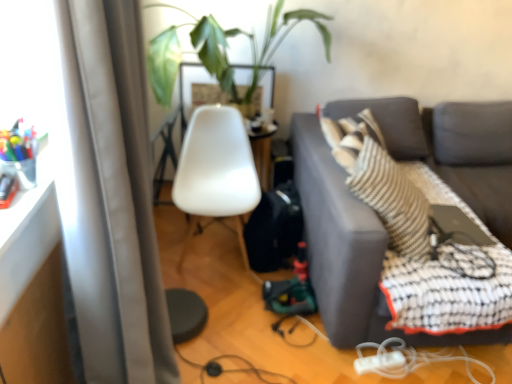
Locate an element on the screen. This screenshot has width=512, height=384. satin gray curtain at left is located at coordinates (110, 195).

Where is `black rubber cable at lower center, arranged as the 2th cable when viewed from the right`? The width and height of the screenshot is (512, 384). black rubber cable at lower center, arranged as the 2th cable when viewed from the right is located at coordinates (231, 369).

Measure the distance between green leafy plant at upper center and camera.

7.15 feet.

Find the location of a particular element. The width and height of the screenshot is (512, 384). green leafy plant at upper center is located at coordinates (222, 49).

Image resolution: width=512 pixels, height=384 pixels. Identify the location of dark gray fabric couch at right. (x=350, y=250).

What is the approximate width of dark gray fabric couch at right?

It is 5.40 feet.

Find the location of a particular element. The width and height of the screenshot is (512, 384). white plastic extension cord at lower center is located at coordinates (380, 362).

Where is `studio couch on the right of white plastic extension cord at lower center`? The image size is (512, 384). studio couch on the right of white plastic extension cord at lower center is located at coordinates (350, 250).

Are dark gray fabric couch at right and white plastic extension cord at lower center making contact?

dark gray fabric couch at right and white plastic extension cord at lower center are not in contact.

Considering the sizes of objects dark gray fabric couch at right and white plastic extension cord at lower center in the image provided, who is shorter, dark gray fabric couch at right or white plastic extension cord at lower center?

white plastic extension cord at lower center is shorter.

Between white matte chair at center and black rubber cable at lower center, which appears as the 1th cable when viewed from the left, which one appears on the right side from the viewer's perspective?

From the viewer's perspective, black rubber cable at lower center, which appears as the 1th cable when viewed from the left, appears more on the right side.

Is white matte chair at center bigger or smaller than black rubber cable at lower center, which appears as the 1th cable when viewed from the left?

Considering their sizes, white matte chair at center takes up more space than black rubber cable at lower center, which appears as the 1th cable when viewed from the left.

The height and width of the screenshot is (384, 512). Identify the location of chair above the black rubber cable at lower center, arranged as the 2th cable when viewed from the right (from a real-world perspective). (216, 165).

In the scene shown: Which object is thinner, white matte chair at center or black rubber cable at lower center, arranged as the 2th cable when viewed from the right?

Thinner between the two is black rubber cable at lower center, arranged as the 2th cable when viewed from the right.

From a real-world perspective, is white plastic cable at lower right, acting as the second cable starting from the left, above or below black matte laptop at right?

Clearly, from a real-world perspective, white plastic cable at lower right, acting as the second cable starting from the left, is below black matte laptop at right.

From the picture: Can you tell me how much white plastic cable at lower right, acting as the second cable starting from the left, and black matte laptop at right differ in facing direction?

The angle between the facing direction of white plastic cable at lower right, acting as the second cable starting from the left, and the facing direction of black matte laptop at right is 176 degrees.

Which of these two, white plastic cable at lower right, which is the first cable in right-to-left order, or black matte laptop at right, is wider?

Wider between the two is white plastic cable at lower right, which is the first cable in right-to-left order.

Is point (386, 350) closer to camera compared to point (454, 219)?

Yes.

Based on their positions, is black matte laptop at right located to the left or right of white matte chair at center?

Clearly, black matte laptop at right is on the right of white matte chair at center in the image.

Which object is thinner, black matte laptop at right or white matte chair at center?

Thinner between the two is black matte laptop at right.

Considering the sizes of objects black matte laptop at right and white matte chair at center in the image provided, who is taller, black matte laptop at right or white matte chair at center?

white matte chair at center is taller.

From a real-world perspective, between black matte laptop at right and white matte chair at center, who is vertically lower?

white matte chair at center is physically lower.

How different are the orientations of white plastic extension cord at lower center and dark gray fabric couch at right in degrees?

white plastic extension cord at lower center and dark gray fabric couch at right are facing 9.8 degrees away from each other.

Is the surface of white plastic extension cord at lower center in direct contact with dark gray fabric couch at right?

No, white plastic extension cord at lower center is not next to dark gray fabric couch at right.

Which object is wider, white plastic extension cord at lower center or dark gray fabric couch at right?

dark gray fabric couch at right.

Considering the positions of point (402, 353) and point (346, 263), is point (402, 353) closer or farther from the camera than point (346, 263)?

Point (402, 353) appears to be farther away from the viewer than point (346, 263).

How far apart are white matte chair at center and white plastic cable at lower right, acting as the second cable starting from the left?

white matte chair at center is 3.86 feet from white plastic cable at lower right, acting as the second cable starting from the left.

Is white matte chair at center at the left side of white plastic cable at lower right, which is the first cable in right-to-left order?

Yes.

Can you tell me how much white matte chair at center and white plastic cable at lower right, which is the first cable in right-to-left order, differ in facing direction?

The angular difference between white matte chair at center and white plastic cable at lower right, which is the first cable in right-to-left order, is 89.9 degrees.

Does white matte chair at center have a lesser height compared to white plastic cable at lower right, which is the first cable in right-to-left order?

No.

Does white plastic cable at lower right, acting as the second cable starting from the left, lie behind dark gray fabric couch at right?

Yes, white plastic cable at lower right, acting as the second cable starting from the left, is further from the viewer.

Looking at this image, is white plastic cable at lower right, which is the first cable in right-to-left order, beside dark gray fabric couch at right?

There is a gap between white plastic cable at lower right, which is the first cable in right-to-left order, and dark gray fabric couch at right.

Is white plastic cable at lower right, which is the first cable in right-to-left order, completely or partially outside of dark gray fabric couch at right?

No, white plastic cable at lower right, which is the first cable in right-to-left order, is inside or overlapping with dark gray fabric couch at right.

Considering the relative positions of white plastic cable at lower right, acting as the second cable starting from the left, and dark gray fabric couch at right in the image provided, is white plastic cable at lower right, acting as the second cable starting from the left, to the right of dark gray fabric couch at right from the viewer's perspective?

Incorrect, white plastic cable at lower right, acting as the second cable starting from the left, is not on the right side of dark gray fabric couch at right.

In order to click on extension cord on the left of dark gray fabric couch at right in this screenshot , I will do `click(380, 362)`.

Find the location of a particular element. The height and width of the screenshot is (384, 512). cable that is the 1st one when counting forward from the white matte chair at center is located at coordinates (231, 369).

Considering their positions, is black rubber cable at lower center, which appears as the 1th cable when viewed from the left, positioned further to dark gray fabric couch at right than white plastic cable at lower right, which is the first cable in right-to-left order?

Based on the image, black rubber cable at lower center, which appears as the 1th cable when viewed from the left, appears to be further to dark gray fabric couch at right.

Which object lies nearer to the anchor point dark gray fabric couch at right, black matte laptop at right or satin gray curtain at left?

black matte laptop at right lies closer to dark gray fabric couch at right than the other object.

When comparing their distances from satin gray curtain at left, does white plastic cable at lower right, acting as the second cable starting from the left, or green leafy plant at upper center seem closer?

Among the two, white plastic cable at lower right, acting as the second cable starting from the left, is located nearer to satin gray curtain at left.

Considering their positions, is satin gray curtain at left positioned further to white plastic extension cord at lower center than black rubber cable at lower center, arranged as the 2th cable when viewed from the right?

satin gray curtain at left lies further to white plastic extension cord at lower center than the other object.

Looking at the image, which one is located closer to green leafy plant at upper center, satin gray curtain at left or dark gray fabric couch at right?

dark gray fabric couch at right lies closer to green leafy plant at upper center than the other object.

Looking at the image, which one is located closer to dark gray fabric couch at right, black rubber cable at lower center, arranged as the 2th cable when viewed from the right, or white plastic extension cord at lower center?

Based on the image, white plastic extension cord at lower center appears to be nearer to dark gray fabric couch at right.

Considering their positions, is white plastic extension cord at lower center positioned closer to white matte chair at center than black rubber cable at lower center, which appears as the 1th cable when viewed from the left?

Based on the image, black rubber cable at lower center, which appears as the 1th cable when viewed from the left, appears to be nearer to white matte chair at center.

Looking at the image, which one is located further to black rubber cable at lower center, arranged as the 2th cable when viewed from the right, white plastic extension cord at lower center or dark gray fabric couch at right?

Based on the image, dark gray fabric couch at right appears to be further to black rubber cable at lower center, arranged as the 2th cable when viewed from the right.

At what (x,y) coordinates should I click in order to perform the action: click on houseplant located between satin gray curtain at left and dark gray fabric couch at right in the left-right direction. Please return your answer as a coordinate pair (x, y). Looking at the image, I should click on (222, 49).

Identify the location of cable located between satin gray curtain at left and white plastic extension cord at lower center in the left-right direction. (231, 369).

The image size is (512, 384). In order to click on extension cord between black rubber cable at lower center, arranged as the 2th cable when viewed from the right, and dark gray fabric couch at right, in the horizontal direction in this screenshot , I will do `click(380, 362)`.

Identify the location of chair situated between satin gray curtain at left and black matte laptop at right from left to right. (216, 165).